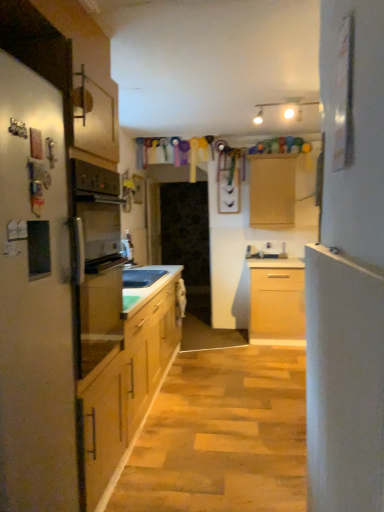
Question: From a real-world perspective, is matte white refrigerator at left located beneath wooden cabinet at center?

Choices:
 (A) no
 (B) yes

Answer: (B)

Question: Is matte white refrigerator at left bigger than wooden cabinet at center?

Choices:
 (A) no
 (B) yes

Answer: (B)

Question: Considering the relative sizes of matte white refrigerator at left and wooden cabinet at center in the image provided, is matte white refrigerator at left shorter than wooden cabinet at center?

Choices:
 (A) no
 (B) yes

Answer: (A)

Question: Can you confirm if matte white refrigerator at left is positioned to the left of wooden cabinet at center?

Choices:
 (A) yes
 (B) no

Answer: (A)

Question: Are matte white refrigerator at left and wooden cabinet at center making contact?

Choices:
 (A) no
 (B) yes

Answer: (A)

Question: From the image's perspective, is wooden cabinet at center positioned above or below white smooth door at right?

Choices:
 (A) below
 (B) above

Answer: (B)

Question: From a real-world perspective, is wooden cabinet at center above or below white smooth door at right?

Choices:
 (A) above
 (B) below

Answer: (A)

Question: Relative to white smooth door at right, is wooden cabinet at center in front or behind?

Choices:
 (A) behind
 (B) front

Answer: (A)

Question: Based on their sizes in the image, would you say wooden cabinet at center is bigger or smaller than white smooth door at right?

Choices:
 (A) big
 (B) small

Answer: (A)

Question: From the image's perspective, is wooden cabinet at center located above or below matte white refrigerator at left?

Choices:
 (A) above
 (B) below

Answer: (A)

Question: Is wooden cabinet at center situated inside matte white refrigerator at left or outside?

Choices:
 (A) inside
 (B) outside

Answer: (B)

Question: Looking at their shapes, would you say wooden cabinet at center is wider or thinner than matte white refrigerator at left?

Choices:
 (A) thin
 (B) wide

Answer: (A)

Question: Would you say wooden cabinet at center is to the left or to the right of matte white refrigerator at left in the picture?

Choices:
 (A) left
 (B) right

Answer: (B)

Question: From a real-world perspective, is matte white refrigerator at left positioned above or below wooden cabinet at center?

Choices:
 (A) below
 (B) above

Answer: (A)

Question: Looking at their shapes, would you say matte white refrigerator at left is wider or thinner than wooden cabinet at center?

Choices:
 (A) thin
 (B) wide

Answer: (B)